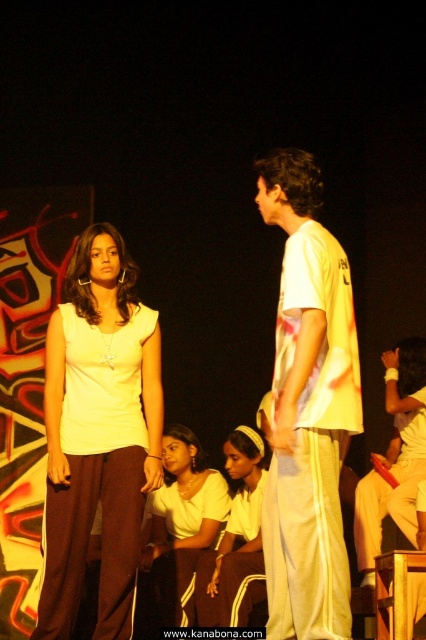
Question: Which of the following is the closest to the observer?

Choices:
 (A) (319, 314)
 (B) (224, 579)
 (C) (149, 544)

Answer: (A)

Question: Which object appears closest to the camera in this image?

Choices:
 (A) white printed t-shirt at center
 (B) matte white top at center
 (C) matte white blouse at center

Answer: (A)

Question: Is matte white top at center positioned at the back of matte white blouse at center?

Choices:
 (A) no
 (B) yes

Answer: (A)

Question: Can you confirm if matte white top at center is bigger than white fabric headband at center?

Choices:
 (A) yes
 (B) no

Answer: (A)

Question: Is white printed t-shirt at center to the left of matte white blouse at center from the viewer's perspective?

Choices:
 (A) no
 (B) yes

Answer: (A)

Question: Which is nearer to the white printed t-shirt at center?

Choices:
 (A) matte white top at center
 (B) white fabric headband at center

Answer: (A)